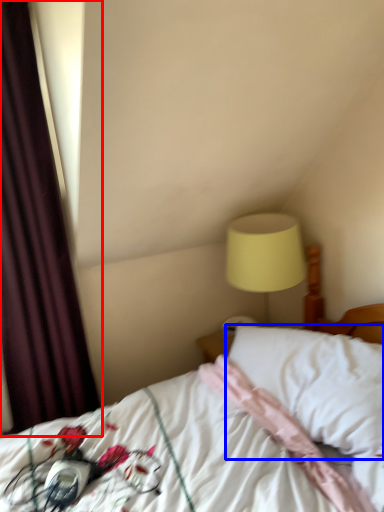
Question: Which object appears farthest to the camera in this image, curtain (highlighted by a red box) or pillow (highlighted by a blue box)?

Choices:
 (A) curtain
 (B) pillow

Answer: (A)